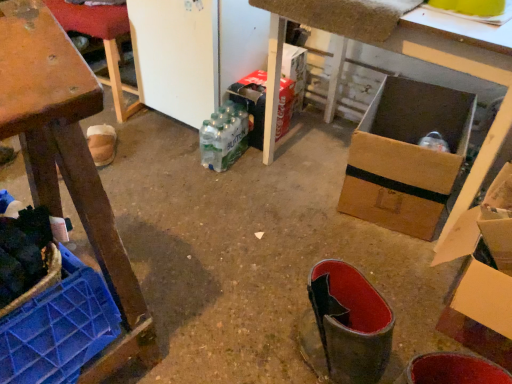
Question: Does point (258, 135) appear closer or farther from the camera than point (475, 223)?

Choices:
 (A) farther
 (B) closer

Answer: (A)

Question: Relative to cardboard box at right, positioned as the 1th cardboard box in right-to-left order, is cardboard box at center, which is counted as the 2th cardboard box, starting from the front, in front or behind?

Choices:
 (A) front
 (B) behind

Answer: (B)

Question: Which object is positioned closest to the wooden crate at left, the 2th furniture from the back?

Choices:
 (A) cardboard box at center, which ranks as the 1th cardboard box in left-to-right order
 (B) cardboard box at center
 (C) brown cardboard box at center
 (D) wooden table at left, the 2th furniture ordered from the bottom
 (E) cardboard box at right, arranged as the 1th cardboard box when viewed from the front

Answer: (B)

Question: Considering the real-world distances, which object is closest to the wooden table at left, the 2th furniture ordered from the bottom?

Choices:
 (A) cardboard box at center
 (B) cardboard box at center, which ranks as the 1th cardboard box in left-to-right order
 (C) wooden crate at left, the 2th furniture from the back
 (D) cardboard box at right, which is counted as the 2th cardboard box, starting from the left
 (E) brown cardboard box at center

Answer: (B)